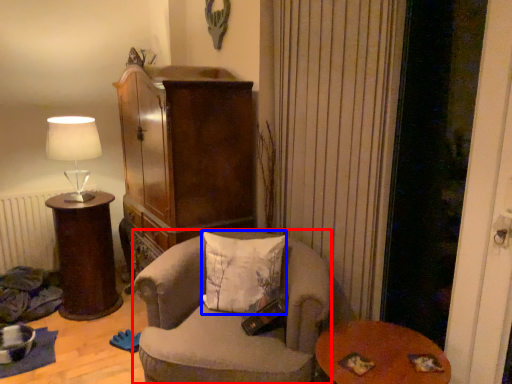
Question: Which point is closer to the camera, chair (highlighted by a red box) or pillow (highlighted by a blue box)?

Choices:
 (A) chair
 (B) pillow

Answer: (A)